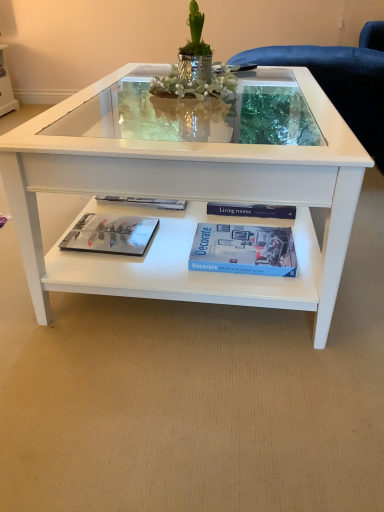
Image resolution: width=384 pixels, height=512 pixels. Find the location of `empty space that is ontop of matte glossy magazine at lower left (from a real-world perspective)`. empty space that is ontop of matte glossy magazine at lower left (from a real-world perspective) is located at coordinates (109, 229).